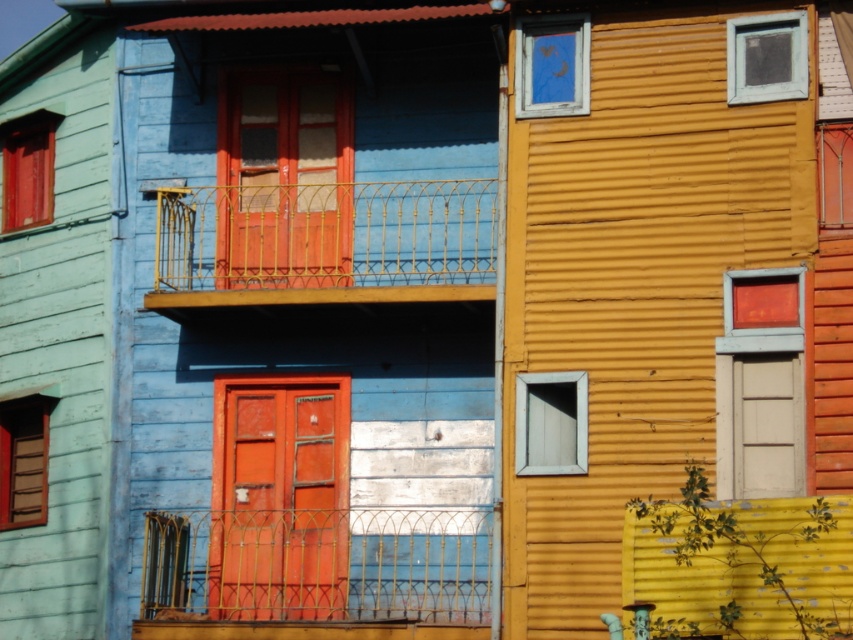
What is the location of the gold wrought iron balcony at center in the image?

The gold wrought iron balcony at center is located at point (325, 243).

You are standing in front of the row of colorful houses. There are two points marked on the image at coordinates point (457, 294) and point (323, 436). Which point is closer to you?

Point (457, 294) is closer to the camera than point (323, 436).